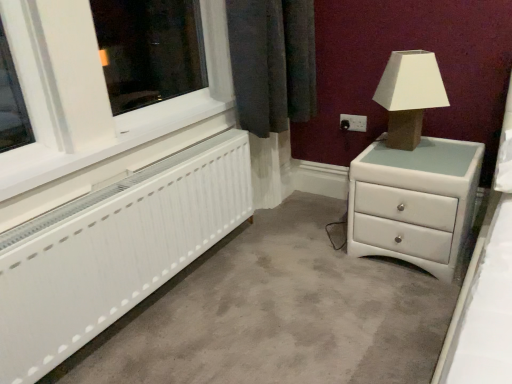
Question: Considering their positions, is white plastic window frame at left located in front of or behind white glossy chest of drawers at right?

Choices:
 (A) behind
 (B) front

Answer: (B)

Question: Visually, is white plastic window frame at left positioned to the left or to the right of white glossy chest of drawers at right?

Choices:
 (A) right
 (B) left

Answer: (B)

Question: Considering the real-world distances, which object is farthest from the white glossy chest of drawers at right?

Choices:
 (A) matte brown table lamp at upper right
 (B) white plastic window frame at left
 (C) white matte radiator at lower left
 (D) black plastic electric outlet at upper right

Answer: (B)

Question: Estimate the real-world distances between objects in this image. Which object is farther from the black plastic electric outlet at upper right?

Choices:
 (A) matte brown table lamp at upper right
 (B) white plastic window frame at left
 (C) white glossy chest of drawers at right
 (D) white matte radiator at lower left

Answer: (D)